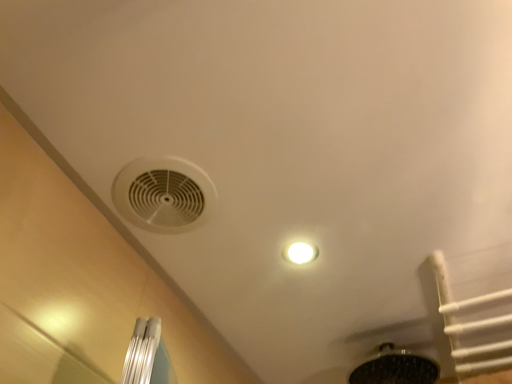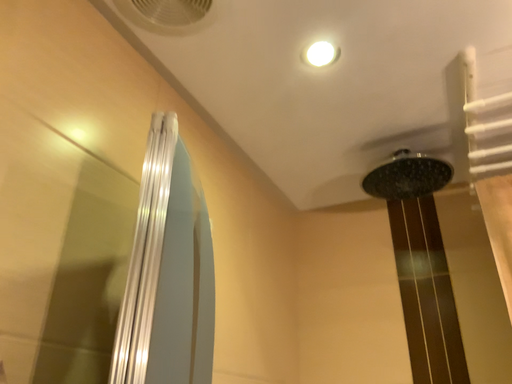
Question: Which way did the camera rotate in the video?

Choices:
 (A) rotated downward
 (B) rotated upward

Answer: (A)